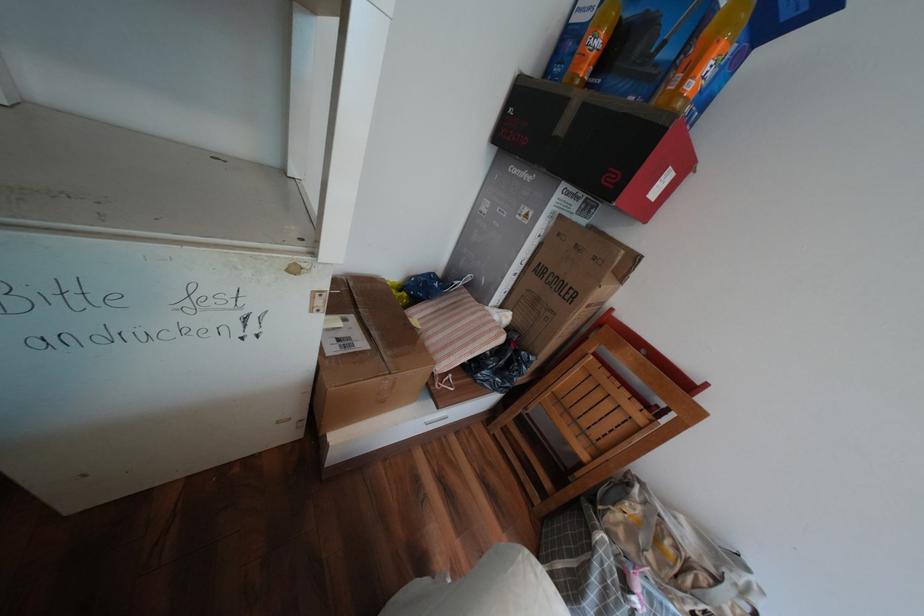
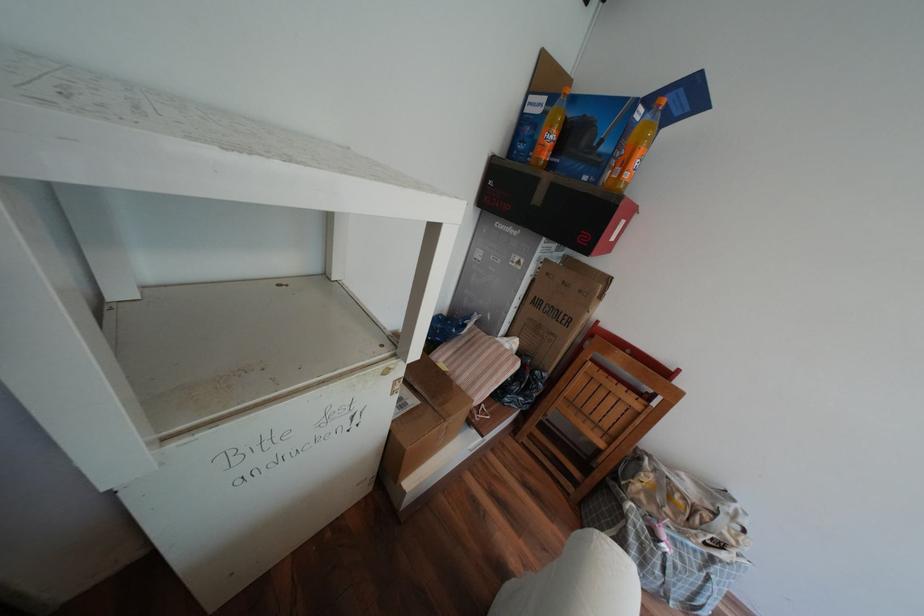
The point at (371, 345) is marked in the first image. Where is the corresponding point in the second image?

(422, 400)